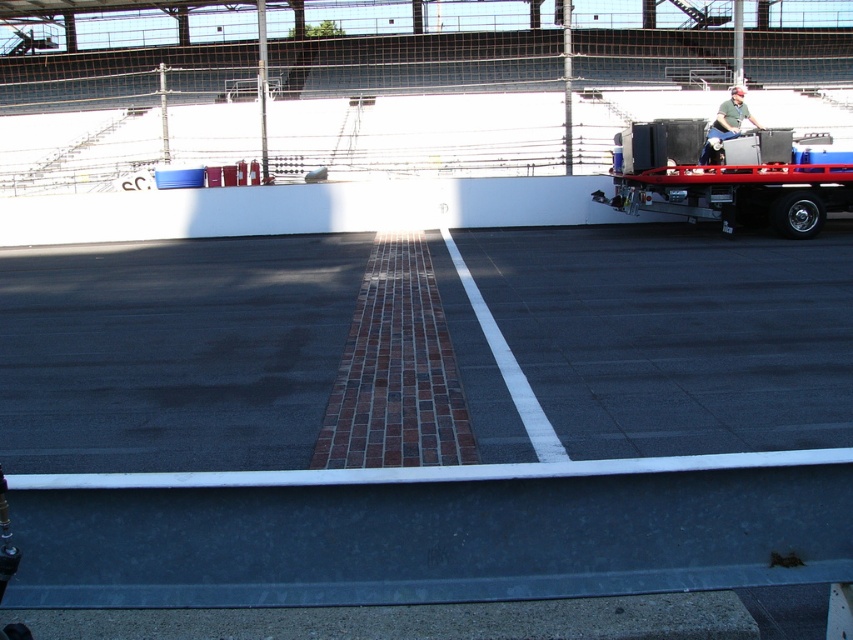
Can you confirm if metallic trailer at right is positioned to the right of green matte shirt at upper right?

Correct, you'll find metallic trailer at right to the right of green matte shirt at upper right.

Find the location of `metallic trailer at right`. metallic trailer at right is located at coordinates [733, 179].